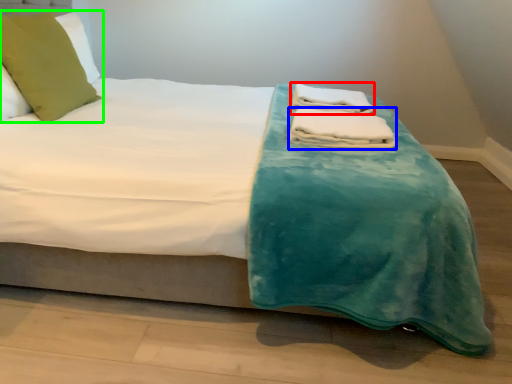
Question: Which object is the farthest from bath towel (highlighted by a red box)? Choose among these: bath towel (highlighted by a blue box) or pillow (highlighted by a green box).

Choices:
 (A) bath towel
 (B) pillow

Answer: (B)